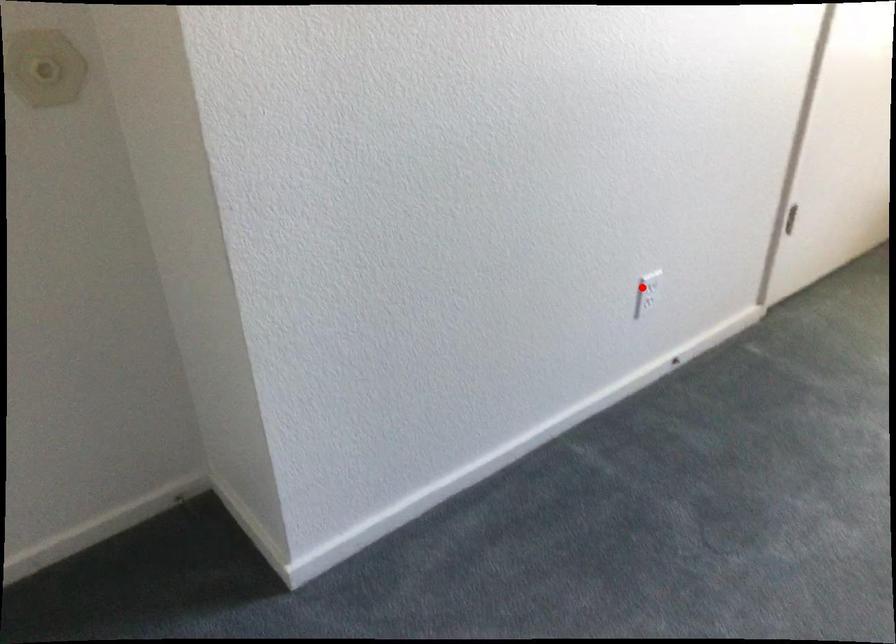
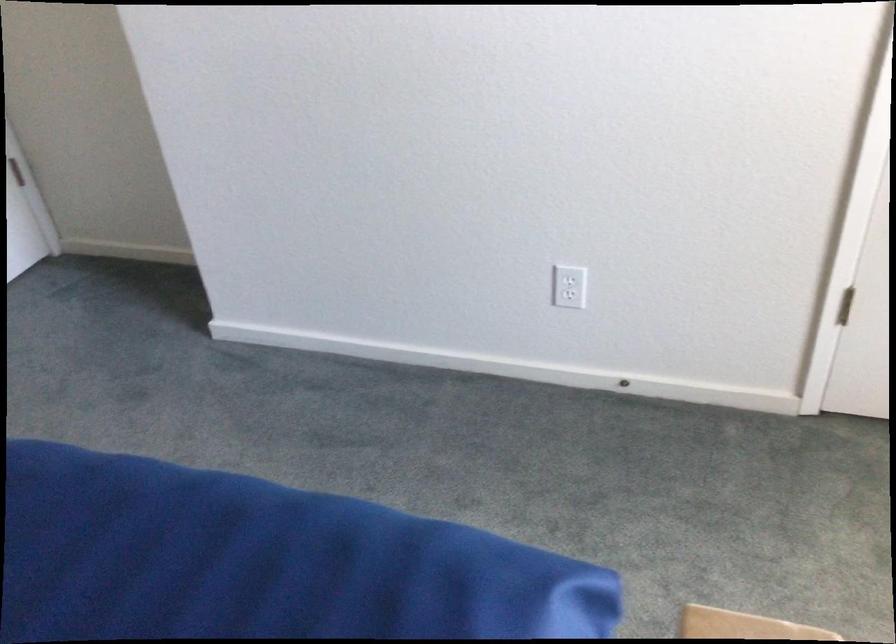
The point at the highlighted location is marked in the first image. Where is the corresponding point in the second image?

(570, 279)